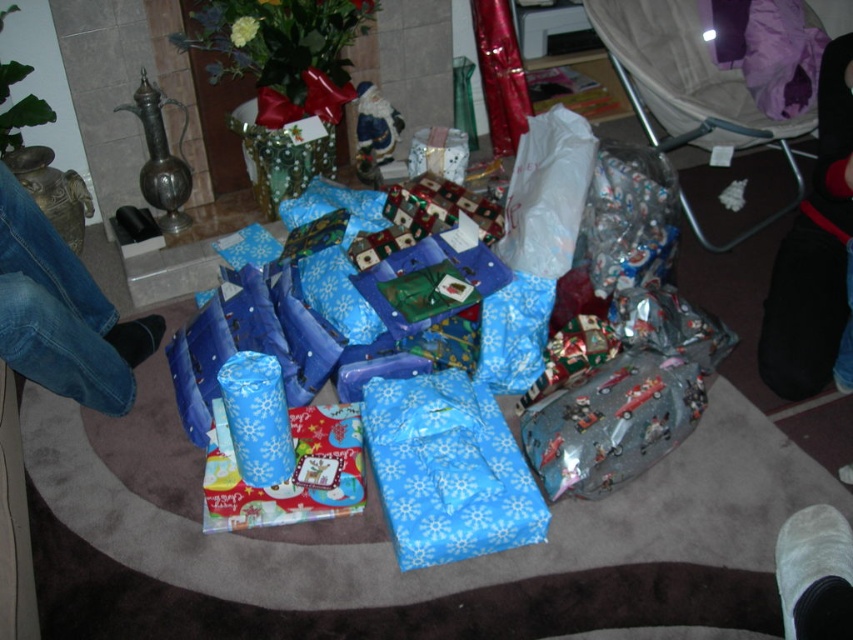
You are planning to place a small decoration on top of the blue paper wrapped gift at center and the blue fabric sock at lower left. Which object can you place the decoration on without it falling off?

The blue paper wrapped gift at center is much taller than the blue fabric sock at lower left, so placing the decoration on the blue paper wrapped gift at center would be more stable and less likely to fall off.

You are standing in the living room and want to pick up the blue paper wrapped gift at center and the blue jeans at left. Which item will you need to reach for first due to their positions?

The blue paper wrapped gift at center is closer to you than the blue jeans at left, so you will need to reach for the blue paper wrapped gift at center first.

You are organizing gifts on a shelf. You have a blue paper wrapped gift at center and a blue fabric sock at lower left. Which one should you place first if you want to arrange them from widest to narrowest?

You should place the blue paper wrapped gift at center first since it is wider than the blue fabric sock at lower left.